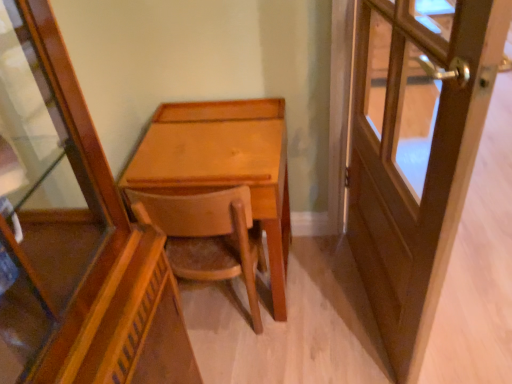
Question: Is wooden door at right outside wooden chair at center?

Choices:
 (A) no
 (B) yes

Answer: (B)

Question: Can you confirm if wooden door at right is shorter than wooden chair at center?

Choices:
 (A) no
 (B) yes

Answer: (A)

Question: Is wooden door at right with wooden chair at center?

Choices:
 (A) yes
 (B) no

Answer: (B)

Question: Considering the relative sizes of wooden door at right and wooden chair at center in the image provided, is wooden door at right thinner than wooden chair at center?

Choices:
 (A) no
 (B) yes

Answer: (B)

Question: Is wooden door at right positioned with its back to wooden chair at center?

Choices:
 (A) yes
 (B) no

Answer: (A)

Question: Is wooden door at right taller or shorter than wooden chair at center?

Choices:
 (A) tall
 (B) short

Answer: (A)

Question: Looking at the image, does wooden door at right seem bigger or smaller compared to wooden chair at center?

Choices:
 (A) small
 (B) big

Answer: (B)

Question: Visually, is wooden door at right positioned to the left or to the right of wooden chair at center?

Choices:
 (A) right
 (B) left

Answer: (A)

Question: Is wooden door at right in front of or behind wooden chair at center in the image?

Choices:
 (A) front
 (B) behind

Answer: (A)

Question: Relative to wooden door at right, is wooden chair at center in front or behind?

Choices:
 (A) front
 (B) behind

Answer: (B)

Question: Is wooden chair at center spatially inside wooden door at right, or outside of it?

Choices:
 (A) inside
 (B) outside

Answer: (B)

Question: Does point tap(135, 205) appear closer or farther from the camera than point tap(358, 205)?

Choices:
 (A) closer
 (B) farther

Answer: (A)

Question: From the image's perspective, is wooden chair at center positioned above or below wooden door at right?

Choices:
 (A) above
 (B) below

Answer: (B)

Question: Looking at the image, does wooden door at right seem bigger or smaller compared to light brown wood desk at center?

Choices:
 (A) big
 (B) small

Answer: (B)

Question: Is wooden door at right spatially inside light brown wood desk at center, or outside of it?

Choices:
 (A) inside
 (B) outside

Answer: (B)